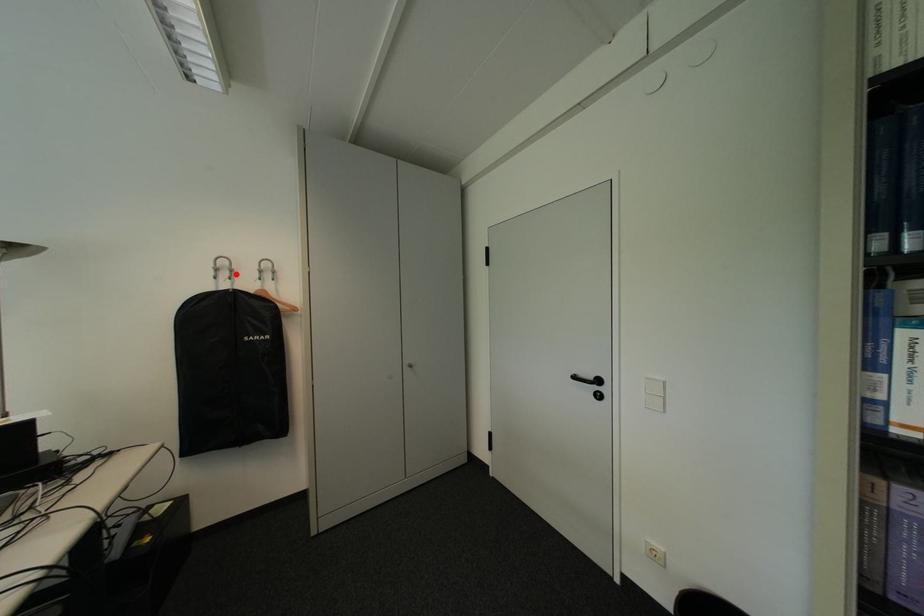
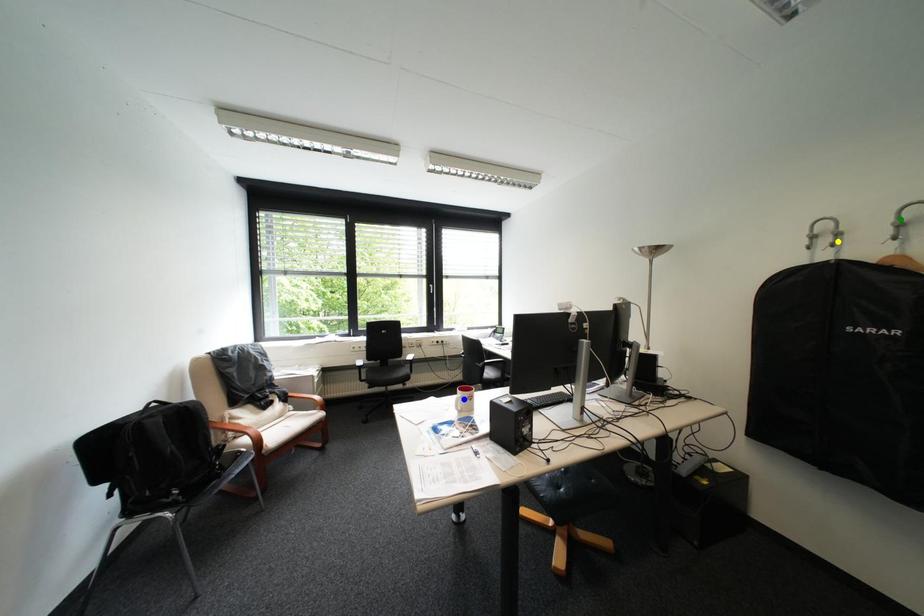
Question: I am providing you with two images of the same scene from different viewpoints. A red point is marked on the first image. You are given multiple points on the second image. Which spot in image 2 lines up with the point in image 1?

Choices:
 (A) blue point
 (B) green point
 (C) yellow point

Answer: (C)